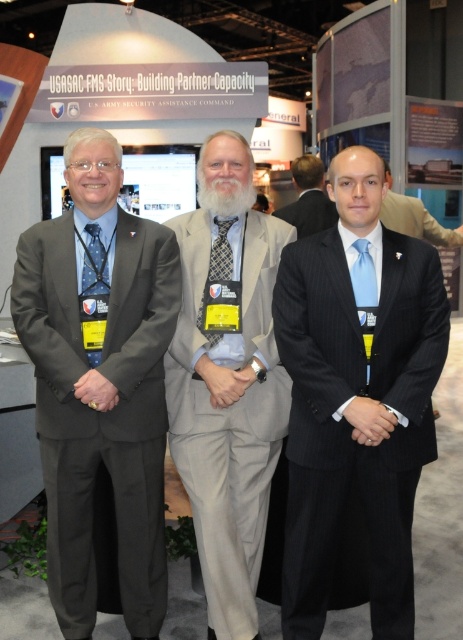
Does point (149, 538) lie in front of point (308, 161)?

Yes, it is in front of point (308, 161).

Is matte gray suit at left further to the viewer compared to gray suit at center?

No.

Who is more forward, (50,492) or (310,182)?

Point (50,492) is in front.

Identify the location of matte gray suit at left. (100, 394).

The height and width of the screenshot is (640, 463). In order to click on gray wool suit at center in this screenshot , I will do 227,380.

Who is more forward, [248,275] or [208,339]?

Point [208,339]

Between point (211, 442) and point (225, 259), which one is positioned in front?

Point (211, 442) is more forward.

In order to click on gray wool suit at center in this screenshot , I will do `click(227, 380)`.

Does point (408, 532) come behind point (93, 278)?

No, it is not.

Which is behind, point (316, 403) or point (98, 292)?

The point (98, 292) is behind.

Where is `pinstripe suit at center`? The height and width of the screenshot is (640, 463). pinstripe suit at center is located at coordinates (356, 400).